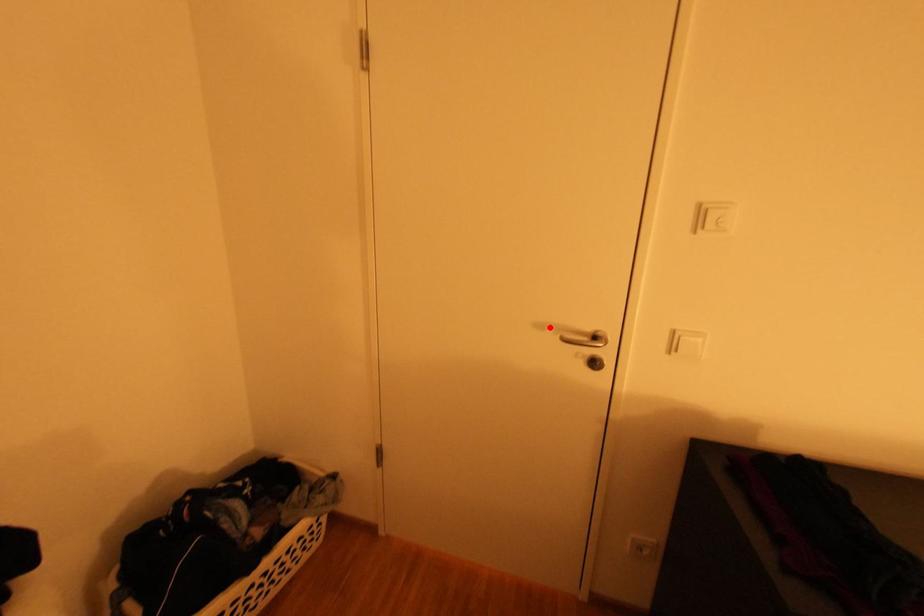
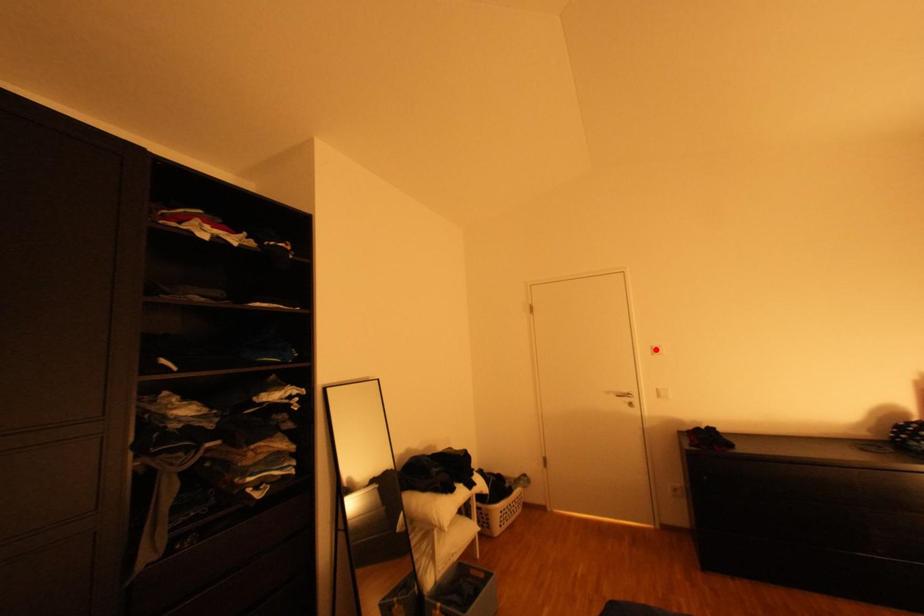
I am providing you with two images of the same scene from different viewpoints. A red point is marked on the first image and another point is marked on the second image. Are the points marked in image1 and image2 representing the same 3D position?

No